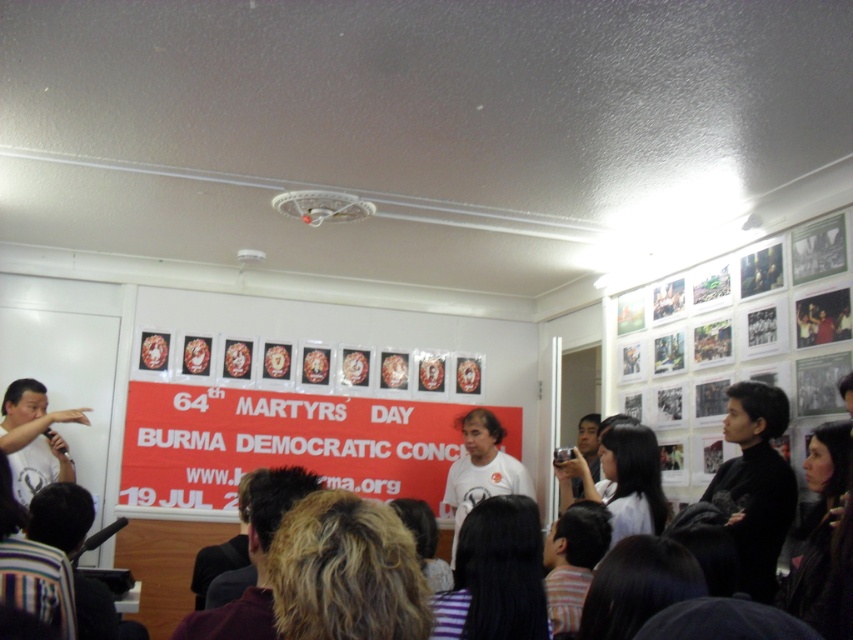
Please look at the scene described. There is a point at coordinates (164,564) in the image. Based on the scene description, can you tell me what this point is located on?

The point at coordinates (164,564) is located on dark hair at center.